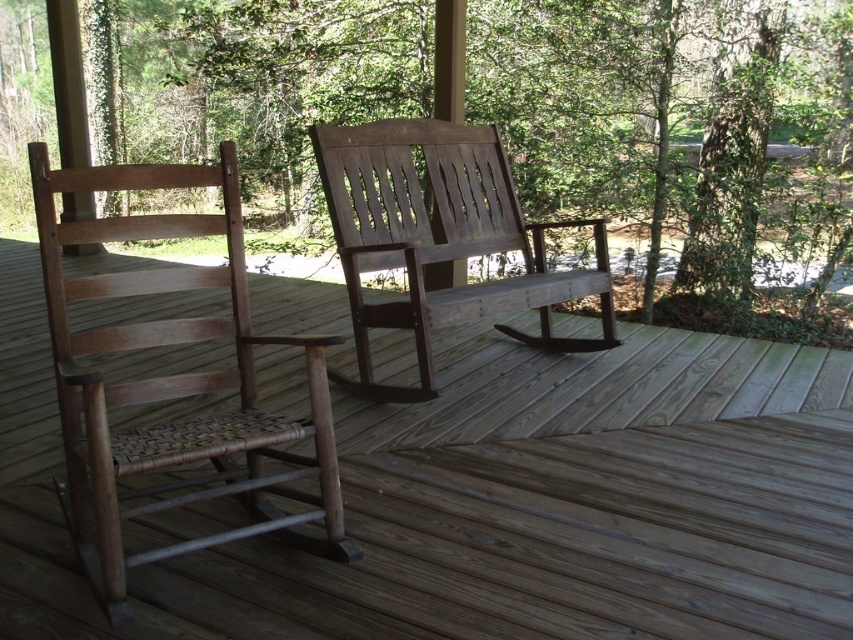
The width and height of the screenshot is (853, 640). Identify the location of wooden woven seat at left. (172, 381).

Is wooden woven seat at left to the left of weathered wood rocking chair at center from the viewer's perspective?

Yes, wooden woven seat at left is to the left of weathered wood rocking chair at center.

Is point (312, 458) farther from camera compared to point (439, 188)?

No, it is in front of (439, 188).

In order to click on wooden woven seat at left in this screenshot , I will do `click(172, 381)`.

Which is more to the left, wooden deck at center or weathered wood rocking chair at center?

wooden deck at center

Is wooden deck at center closer to the viewer compared to weathered wood rocking chair at center?

Yes, it is.

Is point (575, 540) closer to camera compared to point (413, 296)?

Yes.

Image resolution: width=853 pixels, height=640 pixels. Find the location of `wooden deck at center`. wooden deck at center is located at coordinates (496, 500).

Is point (32, 609) positioned in front of point (102, 177)?

Yes, it is.

Is wooden deck at center further to the viewer compared to wooden woven seat at left?

That is False.

What are the coordinates of `wooden deck at center` in the screenshot? It's located at (496, 500).